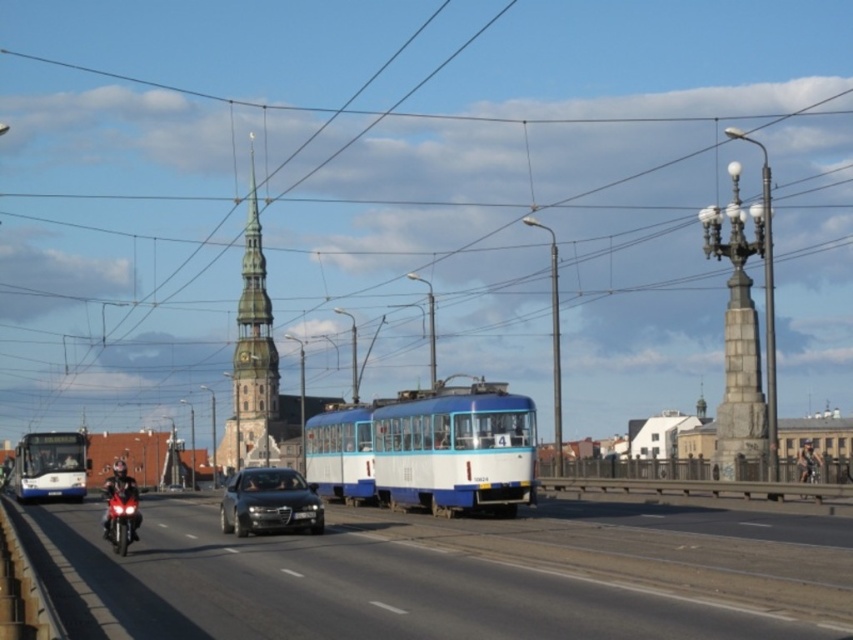
Question: Which of these objects is positioned farthest from the shiny black motorcycle at center?

Choices:
 (A) black rubber motorcycle at lower left
 (B) smooth stone spire at center
 (C) white glossy bus at left
 (D) sleek black sedan at center

Answer: (B)

Question: Estimate the real-world distances between objects in this image. Which object is closer to the white glossy bus at left?

Choices:
 (A) blue matte tram at center
 (B) smooth stone spire at center
 (C) shiny red motorcycle at lower left
 (D) black rubber motorcycle at lower left

Answer: (A)

Question: Which of these objects is positioned farthest from the sleek black sedan at center?

Choices:
 (A) blue matte tram at center
 (B) shiny red motorcycle at lower left
 (C) black rubber motorcycle at lower left
 (D) smooth stone spire at center

Answer: (D)

Question: Can you confirm if smooth stone spire at center is wider than white glossy bus at left?

Choices:
 (A) no
 (B) yes

Answer: (A)

Question: Is sleek black sedan at center below shiny red motorcycle at lower left?

Choices:
 (A) yes
 (B) no

Answer: (A)

Question: Can you confirm if blue matte tram at center is smaller than sleek black sedan at center?

Choices:
 (A) yes
 (B) no

Answer: (B)